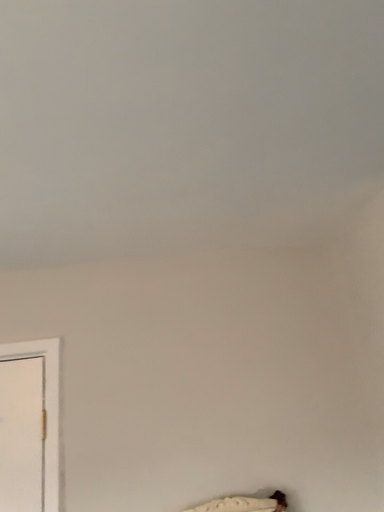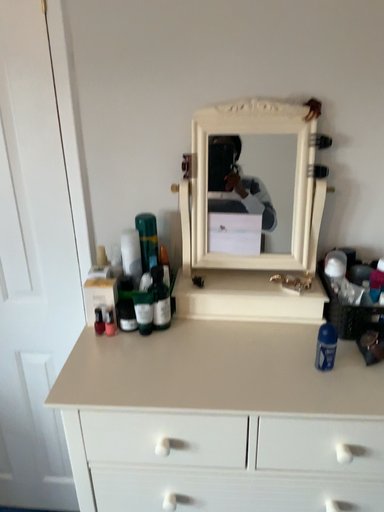
Question: How did the camera likely rotate when shooting the video?

Choices:
 (A) rotated downward
 (B) rotated upward

Answer: (A)